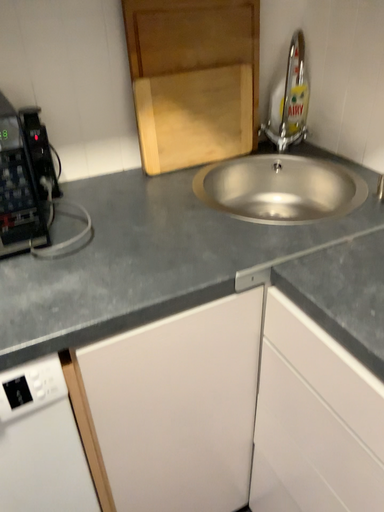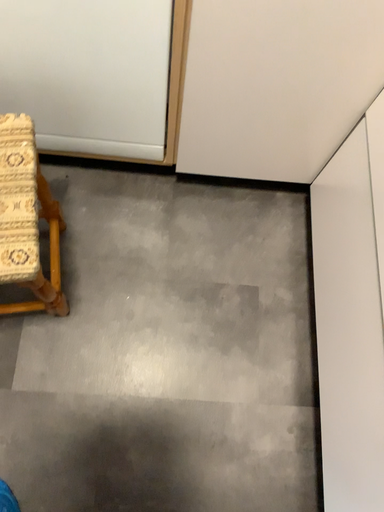
Question: Which way did the camera rotate in the video?

Choices:
 (A) rotated right
 (B) rotated left

Answer: (B)